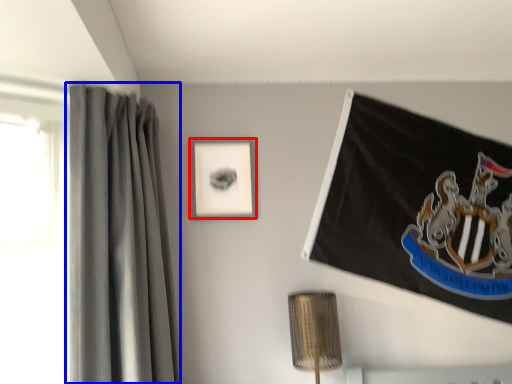
Question: Which point is further to the camera, picture frame (highlighted by a red box) or curtain (highlighted by a blue box)?

Choices:
 (A) picture frame
 (B) curtain

Answer: (A)